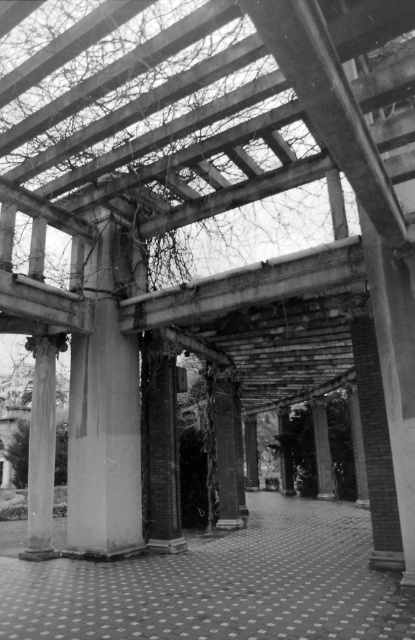
You are standing under the pergola and notice two central supports. According to the image, which one is directly above the other between the smooth stone column at center and the smooth concrete pillar at center?

The smooth stone column at center is positioned over the smooth concrete pillar at center, so the smooth stone column at center is directly above the smooth concrete pillar at center.

You are standing at the entrance of the pergola and see a point marked at coordinates (227, 451). What object is located at that point?

The point at coordinates (227, 451) corresponds to the smooth stone column at center.